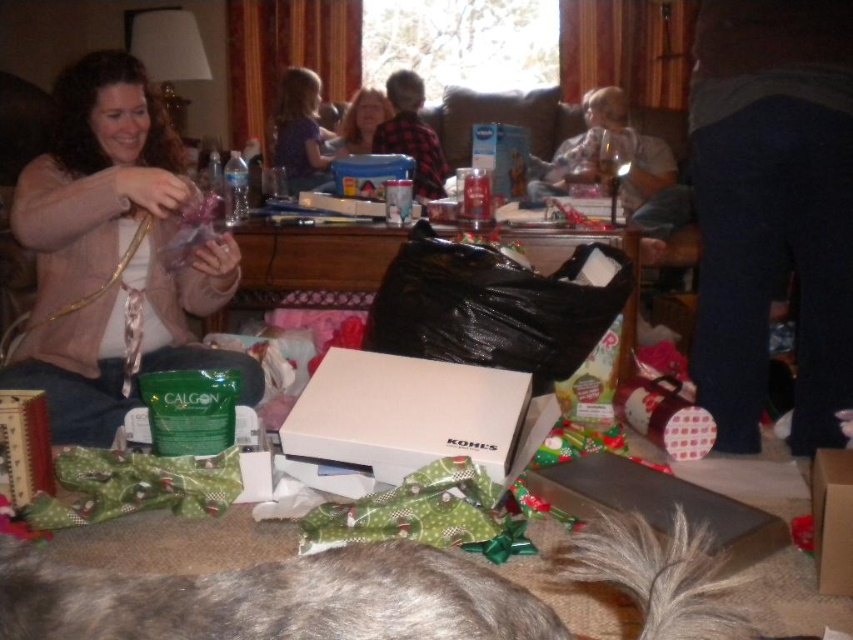
Question: Which object is the closest to the pink fabric at left?

Choices:
 (A) fuzzy fur tail at lower center
 (B) white cardboard box at center
 (C) purple dotted shirt at upper center
 (D) flannel shirt at center

Answer: (B)

Question: Which of the following is the farthest from the observer?

Choices:
 (A) (520, 372)
 (B) (509, 580)
 (C) (318, 177)

Answer: (C)

Question: Can you confirm if fuzzy fur tail at lower center is smaller than gray fluffy tail at lower center?

Choices:
 (A) yes
 (B) no

Answer: (B)

Question: Is gray fluffy tail at lower center behind flannel shirt at center?

Choices:
 (A) yes
 (B) no

Answer: (B)

Question: Estimate the real-world distances between objects in this image. Which object is closer to the purple dotted shirt at upper center?

Choices:
 (A) blonde hair at center
 (B) gray fluffy tail at lower center
 (C) pink fabric at left
 (D) fuzzy fur tail at lower center

Answer: (A)

Question: Is fuzzy fur tail at lower center below pink fabric at left?

Choices:
 (A) yes
 (B) no

Answer: (A)